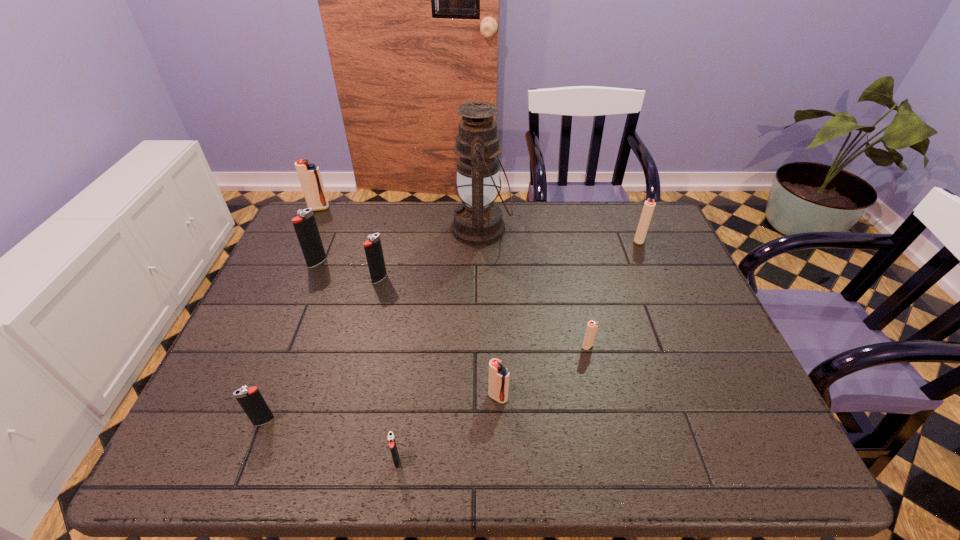
Locate an element on the screen. object situated at the far right corner is located at coordinates (649, 205).

What are the coordinates of `vacant region at the far edge of the desktop` in the screenshot? It's located at (559, 206).

Image resolution: width=960 pixels, height=540 pixels. What are the coordinates of `free spot at the near edge of the desktop` in the screenshot? It's located at (696, 462).

Image resolution: width=960 pixels, height=540 pixels. What are the coordinates of `vacant space at the left edge` in the screenshot? It's located at (283, 392).

Where is `free space at the right edge`? The width and height of the screenshot is (960, 540). free space at the right edge is located at coordinates point(665,339).

Find the location of a particular element. The width and height of the screenshot is (960, 540). vacant space at the far left corner is located at coordinates (293, 240).

At what (x,y) coordinates should I click in order to perform the action: click on vacant space at the far right corner of the desktop. Please return your answer as a coordinate pair (x, y). Looking at the image, I should click on (630, 201).

You are a GUI agent. You are given a task and a screenshot of the screen. Output one action in this format:
    pyautogui.click(x=<x>, y=<y>)
    Task: Click on the vacant space at the near right corner of the desktop
    This screenshot has height=540, width=960.
    Given the screenshot: What is the action you would take?
    pyautogui.click(x=783, y=459)

The image size is (960, 540). Find the location of `free space between the smallest black igniter and the second biggest black igniter`. free space between the smallest black igniter and the second biggest black igniter is located at coordinates (388, 370).

The width and height of the screenshot is (960, 540). I want to click on free space between the biggest black igniter and the seventh igniter from left to right, so click(x=452, y=304).